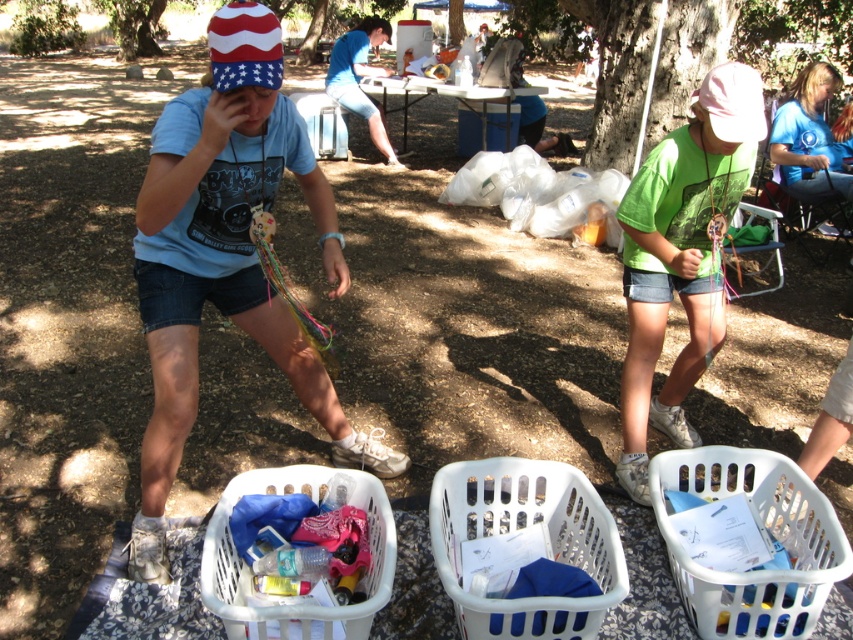
Question: Does blue t-shirt at lower right appear over metallic silver picnic table at center?

Choices:
 (A) yes
 (B) no

Answer: (B)

Question: From the image, what is the correct spatial relationship of white plastic basket at lower right in relation to white plastic basket at lower center?

Choices:
 (A) above
 (B) below

Answer: (A)

Question: Can you confirm if white plastic basket at lower center is positioned below blue t-shirt at lower right?

Choices:
 (A) no
 (B) yes

Answer: (B)

Question: Which object is farther from the camera taking this photo?

Choices:
 (A) white plastic basket at lower right
 (B) green matte shirt at center
 (C) metallic silver picnic table at center
 (D) white plastic basket at center

Answer: (C)

Question: Considering the real-world distances, which object is farthest from the blue t-shirt at lower right?

Choices:
 (A) white plastic basket at center
 (B) green matte shirt at center
 (C) metallic silver picnic table at center

Answer: (A)

Question: Based on their relative distances, which object is farther from the white plastic basket at lower center?

Choices:
 (A) green matte shirt at center
 (B) white plastic basket at center

Answer: (A)